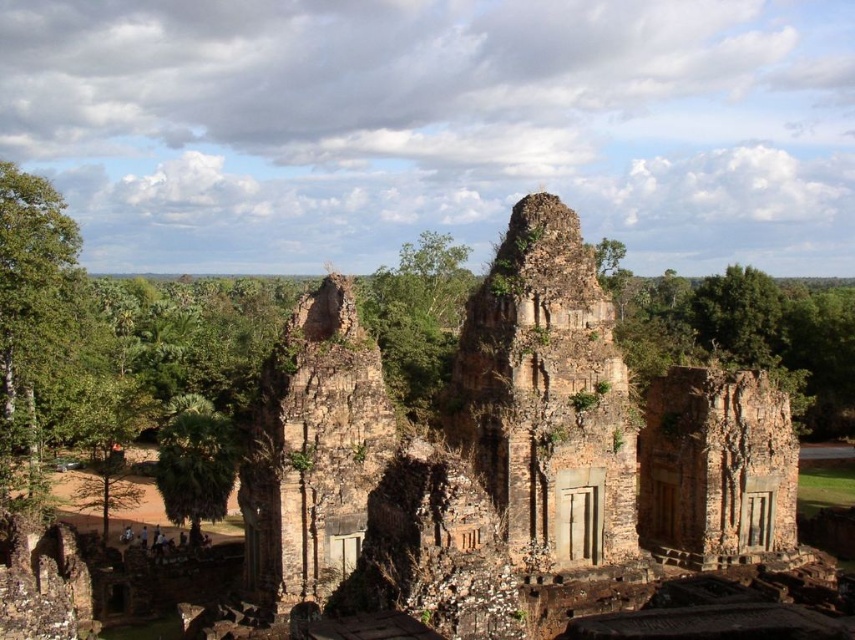
Question: Is green leafy tree at left closer to the viewer compared to green leafy palm tree at lower left?

Choices:
 (A) no
 (B) yes

Answer: (A)

Question: Which point is farther to the camera?

Choices:
 (A) (63, 212)
 (B) (174, 397)
 (C) (634, 563)

Answer: (B)

Question: Which object is the closest to the brown stone ruins at center?

Choices:
 (A) green leafy tree at left
 (B) green leafy palm tree at lower left

Answer: (B)

Question: Does green leafy tree at left lie in front of green leafy palm tree at lower left?

Choices:
 (A) no
 (B) yes

Answer: (A)

Question: Does brown stone ruins at center have a lesser width compared to green leafy palm tree at lower left?

Choices:
 (A) no
 (B) yes

Answer: (A)

Question: Which point appears closest to the camera in this image?

Choices:
 (A) (22, 376)
 (B) (643, 579)
 (C) (190, 508)

Answer: (B)